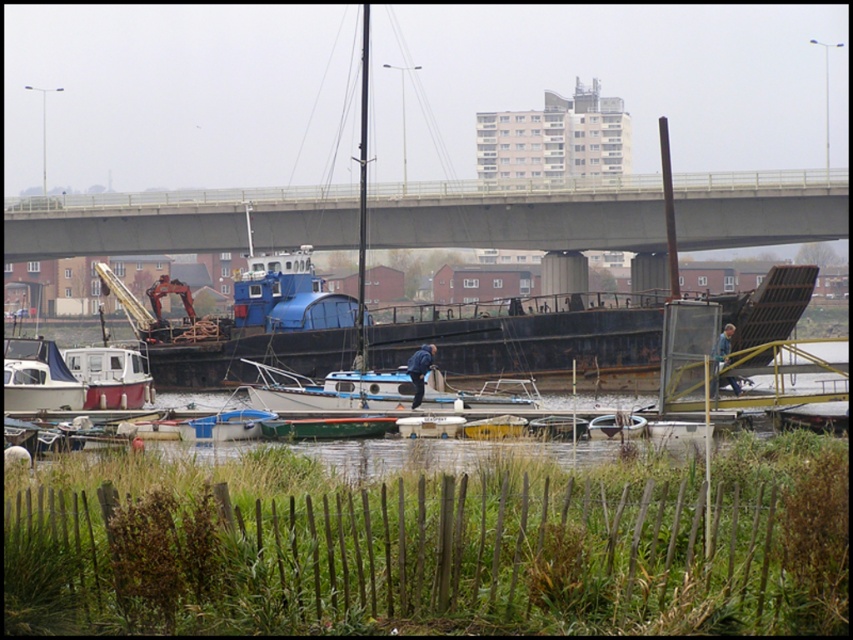
Question: Which of the following is the closest to the observer?

Choices:
 (A) white matte sailboat at lower left
 (B) gray concrete bridge at upper center
 (C) white matte sailboat at center

Answer: (C)

Question: Does gray concrete bridge at upper center come behind white matte sailboat at center?

Choices:
 (A) no
 (B) yes

Answer: (B)

Question: Does gray concrete bridge at upper center appear on the right side of white matte sailboat at center?

Choices:
 (A) yes
 (B) no

Answer: (B)

Question: Does gray concrete bridge at upper center have a lesser width compared to white matte sailboat at lower left?

Choices:
 (A) yes
 (B) no

Answer: (B)

Question: Which of the following is the farthest from the observer?

Choices:
 (A) white matte sailboat at lower left
 (B) white matte sailboat at center

Answer: (A)

Question: Considering the real-world distances, which object is closest to the white matte sailboat at center?

Choices:
 (A) white matte sailboat at lower left
 (B) gray concrete bridge at upper center

Answer: (A)